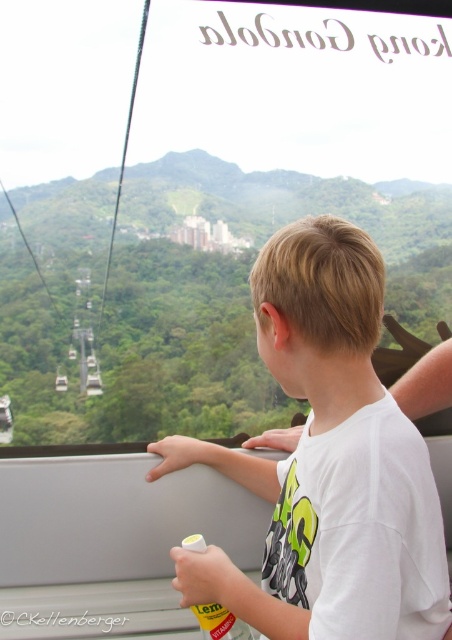
You are a traveler inside the cable car and want to place both the white cotton shirt at center and the yellow plastic bottle at lower center into your backpack. Which item should you put first to ensure both fit properly?

The yellow plastic bottle at lower center should be placed first because the white cotton shirt at center is bigger and can be placed over it to maximize space.

You are a passenger in the cable car and want to place a small bag between the white cotton shirt at center and the yellow plastic bottle at lower center. Based on their positions, where should you place the bag?

You should place the bag to the left of the yellow plastic bottle at lower center since the white cotton shirt at center is already to the right of it.

You are a passenger in the cable car and want to reach the yellow plastic bottle at lower center to take a drink. Is the white cotton shirt at center blocking your access to it?

The white cotton shirt at center is in front of the yellow plastic bottle at lower center, so it is blocking access to the bottle.